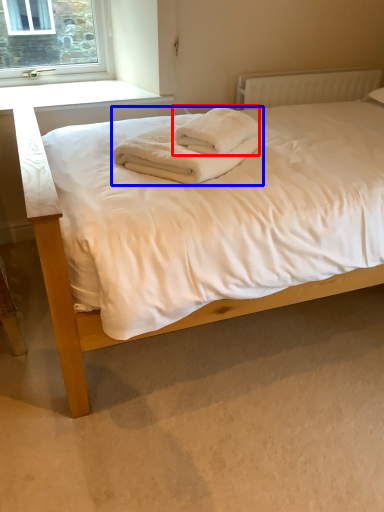
Question: Which point is closer to the camera, towel (highlighted by a red box) or bath towel (highlighted by a blue box)?

Choices:
 (A) towel
 (B) bath towel

Answer: (B)